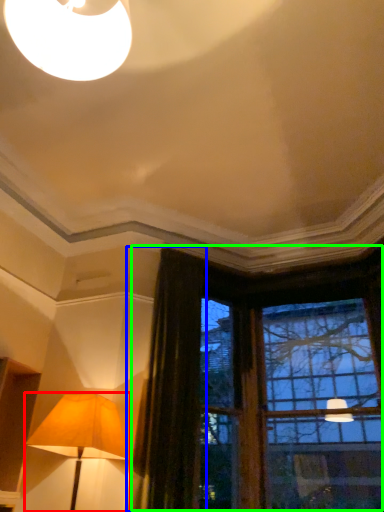
Question: Which is nearer to the lamp (highlighted by a red box)? curtain (highlighted by a blue box) or window (highlighted by a green box).

Choices:
 (A) curtain
 (B) window

Answer: (A)